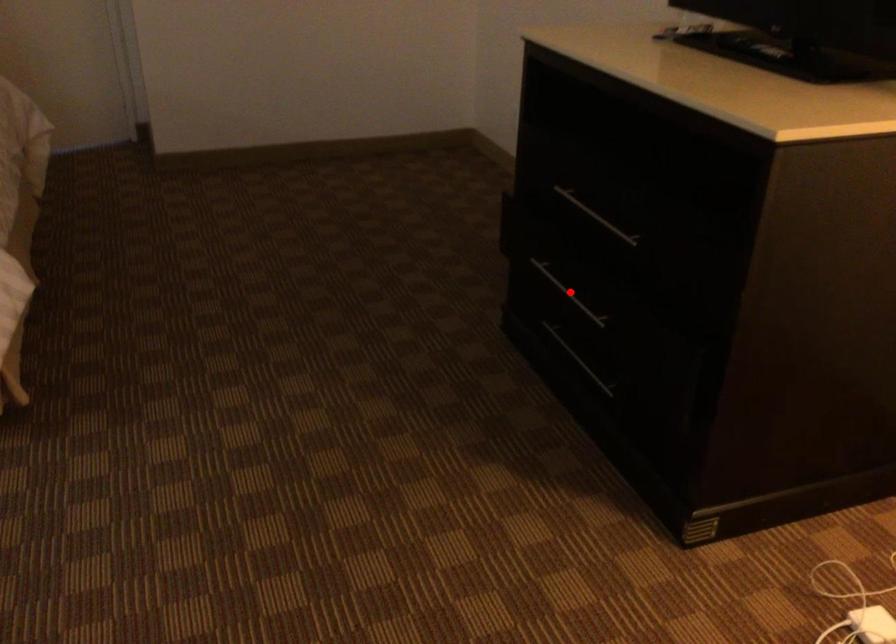
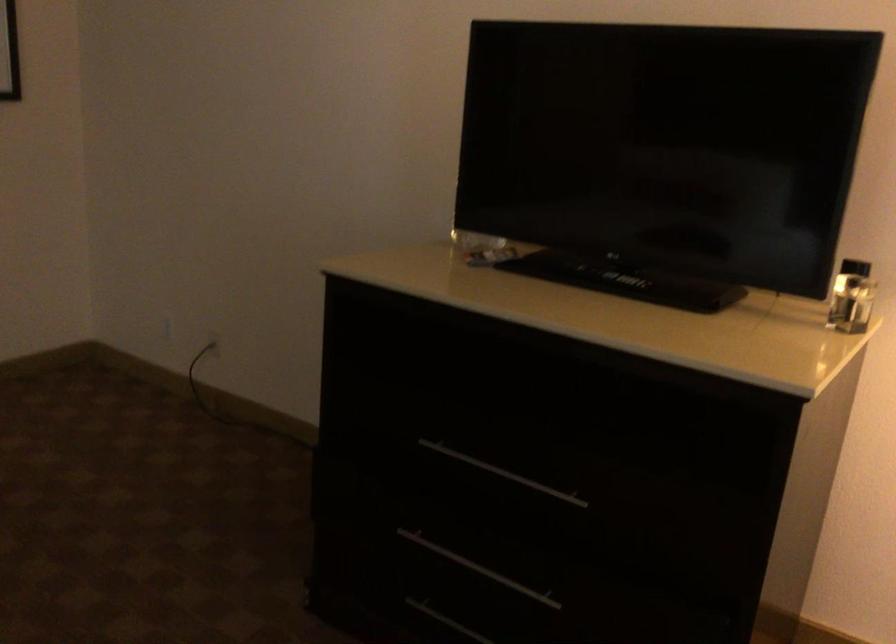
Question: A red point is marked in image1. In image2, is the corresponding 3D point closer to the camera or farther? Reply with the corresponding letter.

Choices:
 (A) The corresponding 3D point is closer.
 (B) The corresponding 3D point is farther.

Answer: (A)